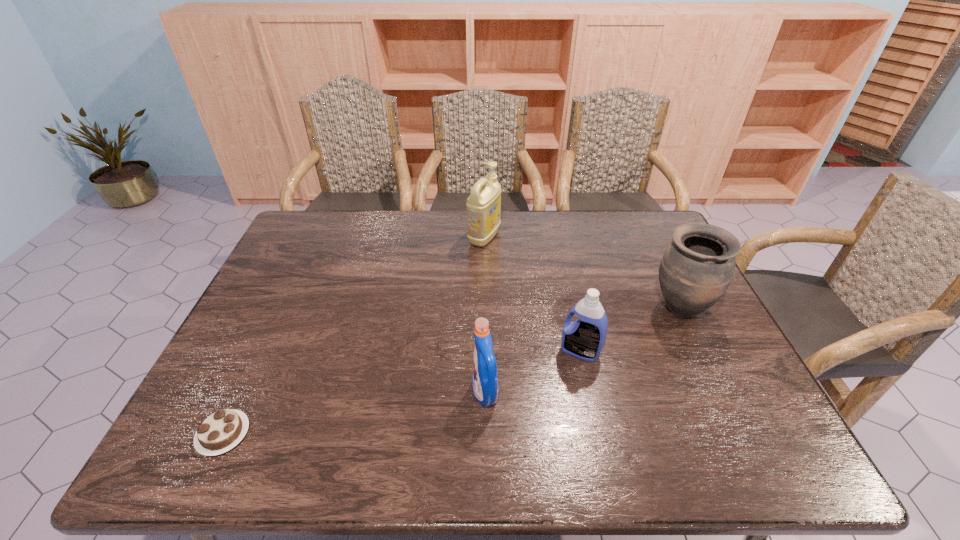
Identify the location of object that is at the near left corner. Image resolution: width=960 pixels, height=540 pixels. (224, 429).

Where is `vacant space at the far edge of the desktop`? The width and height of the screenshot is (960, 540). vacant space at the far edge of the desktop is located at coordinates (599, 248).

I want to click on vacant space at the near edge, so click(x=603, y=442).

This screenshot has height=540, width=960. What are the coordinates of `vacant area at the left edge of the desktop` in the screenshot? It's located at (296, 322).

Where is `vacant space at the right edge`? This screenshot has width=960, height=540. vacant space at the right edge is located at coordinates (708, 366).

Identify the location of vacant area at the far right corner of the desktop. This screenshot has height=540, width=960. (646, 225).

You are a GUI agent. You are given a task and a screenshot of the screen. Output one action in this format:
    pyautogui.click(x=<x>, y=<y>)
    Task: Click on the vacant area at the near right corner of the desktop
    The height and width of the screenshot is (540, 960).
    Given the screenshot: What is the action you would take?
    pyautogui.click(x=704, y=434)

At what (x,y) coordinates should I click in order to perform the action: click on free spot between the chocolate cake and the rightmost detergent. Please return your answer as a coordinate pair (x, y). Looking at the image, I should click on (402, 393).

At what (x,y) coordinates should I click in order to perform the action: click on unoccupied area between the fourth object from left to right and the fourth nearest object. Please return your answer as a coordinate pair (x, y). The width and height of the screenshot is (960, 540). Looking at the image, I should click on (630, 330).

The image size is (960, 540). What are the coordinates of `empty space between the leftmost object and the fourth object from left to right` in the screenshot? It's located at (402, 393).